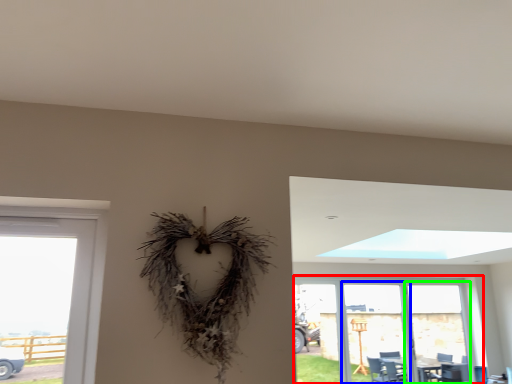
Question: Considering the real-world distances, which object is closest to window (highlighted by a red box)? screen door (highlighted by a blue box) or screen door (highlighted by a green box).

Choices:
 (A) screen door
 (B) screen door

Answer: (A)